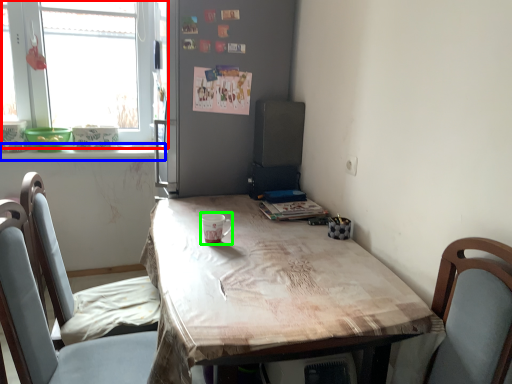
Question: Estimate the real-world distances between objects in this image. Which object is closer to window (highlighted by a red box), window sill (highlighted by a blue box) or coffee cup (highlighted by a green box)?

Choices:
 (A) window sill
 (B) coffee cup

Answer: (A)